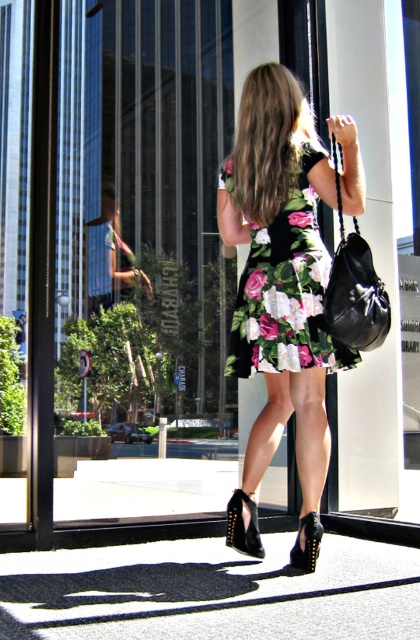
You are a photographer trying to capture the woman in the image. You notice two black studded sandal at lower center and black studded leather sandal at lower center. Which one is closer to the camera?

The black studded sandal at lower center is closer to the camera because the black studded leather sandal at lower center is behind it.

You are a photographer adjusting your camera settings to capture the woman in the scene. You notice two points in the image at coordinates point (307, 369) and point (247, 355). Which point should you focus on to ensure the woman is in sharp focus?

You should focus on point (307, 369) because it is closer to the camera than point (247, 355), ensuring the woman is in sharp focus.